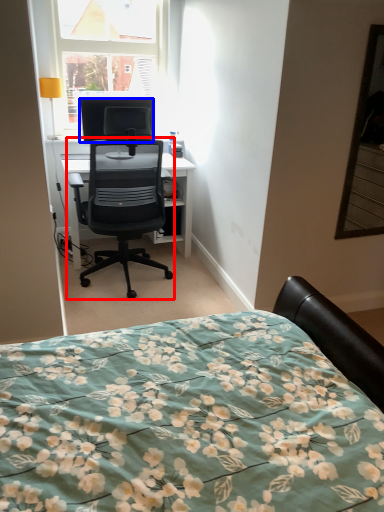
Question: Which of the following is the closest to the observer, chair (highlighted by a red box) or television (highlighted by a blue box)?

Choices:
 (A) chair
 (B) television

Answer: (A)